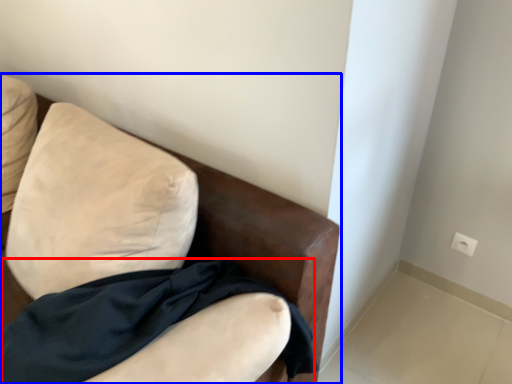
Question: Which of the following is the closest to the observer, fabric (highlighted by a red box) or furniture (highlighted by a blue box)?

Choices:
 (A) fabric
 (B) furniture

Answer: (B)